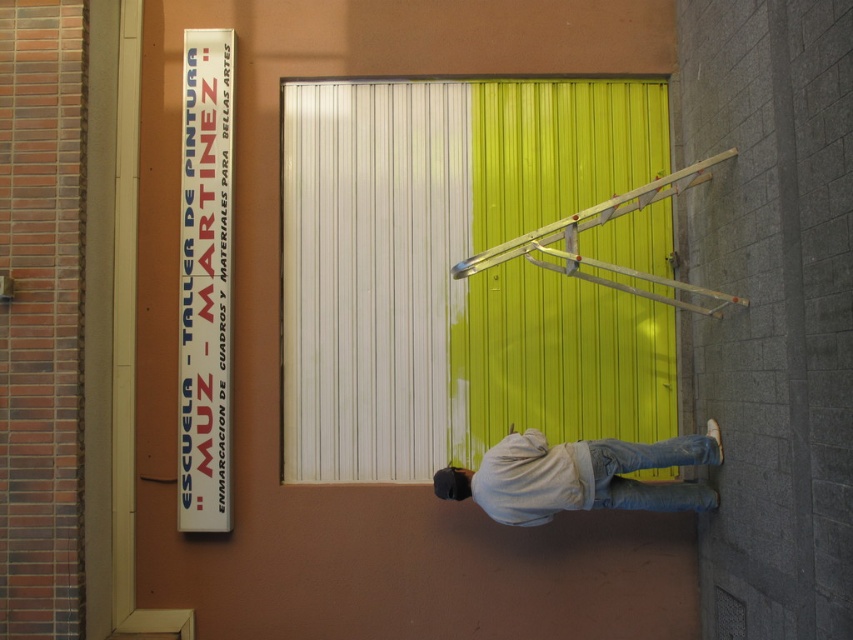
Who is positioned more to the right, light gray cotton shirt at lower right or metallic silver ladder at center?

From the viewer's perspective, metallic silver ladder at center appears more on the right side.

Is light gray cotton shirt at lower right bigger than metallic silver ladder at center?

No, light gray cotton shirt at lower right is not bigger than metallic silver ladder at center.

You are a GUI agent. You are given a task and a screenshot of the screen. Output one action in this format:
    pyautogui.click(x=<x>, y=<y>)
    Task: Click on the light gray cotton shirt at lower right
    This screenshot has height=640, width=853.
    Given the screenshot: What is the action you would take?
    pyautogui.click(x=579, y=476)

Who is more distant from viewer, (579, 273) or (637, 499)?

Positioned behind is point (637, 499).

Does metallic silver ladder at center have a smaller size compared to jeans at lower right?

No, metallic silver ladder at center is not smaller than jeans at lower right.

Image resolution: width=853 pixels, height=640 pixels. Describe the element at coordinates (601, 225) in the screenshot. I see `metallic silver ladder at center` at that location.

At what (x,y) coordinates should I click in order to perform the action: click on metallic silver ladder at center. Please return your answer as a coordinate pair (x, y). Looking at the image, I should click on (601, 225).

Does light gray cotton shirt at lower right appear under jeans at lower right?

Yes, light gray cotton shirt at lower right is below jeans at lower right.

Between point (521, 499) and point (645, 508), which one is positioned behind?

Positioned behind is point (645, 508).

Locate an element on the screen. Image resolution: width=853 pixels, height=640 pixels. light gray cotton shirt at lower right is located at coordinates click(579, 476).